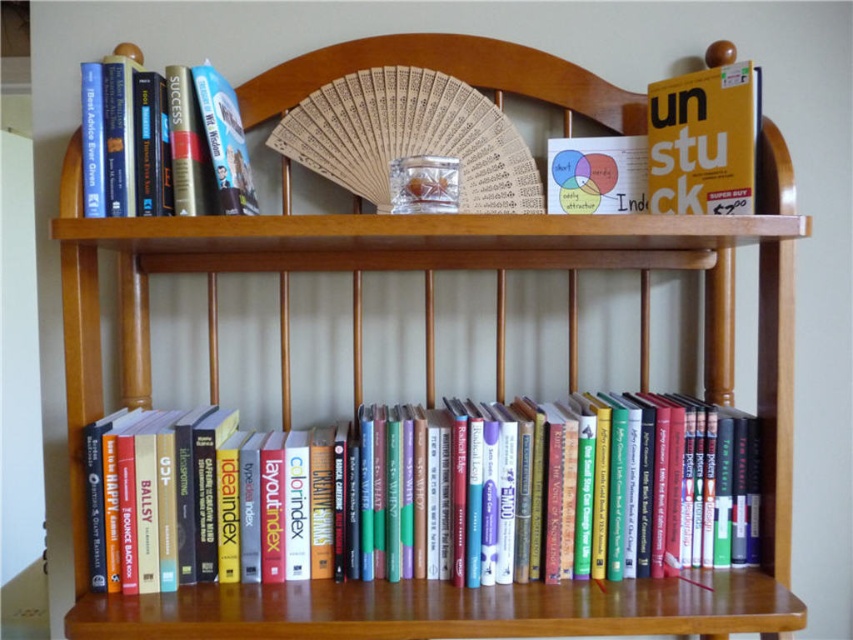
Does hardcover book at upper left come behind matte yellow book at upper right?

No, hardcover book at upper left is in front of matte yellow book at upper right.

Is hardcover book at upper left closer to the viewer compared to matte yellow book at upper right?

Yes.

Is point (90, 156) behind point (735, 72)?

No, it is in front of (735, 72).

Locate an element on the screen. The height and width of the screenshot is (640, 853). hardcover book at upper left is located at coordinates (170, 140).

Can you confirm if hardcover books at lower center is positioned to the right of hardcover book at upper left?

Correct, you'll find hardcover books at lower center to the right of hardcover book at upper left.

Does hardcover books at lower center have a lesser height compared to hardcover book at upper left?

Yes.

Who is more forward, (312, 534) or (190, 180)?

Point (190, 180) is more forward.

You are a GUI agent. You are given a task and a screenshot of the screen. Output one action in this format:
    pyautogui.click(x=<x>, y=<y>)
    Task: Click on the hardcover books at lower center
    
    Given the screenshot: What is the action you would take?
    pyautogui.click(x=425, y=496)

Who is positioned more to the right, hardcover books at lower center or matte yellow book at upper right?

matte yellow book at upper right

Does hardcover books at lower center appear on the right side of matte yellow book at upper right?

In fact, hardcover books at lower center is to the left of matte yellow book at upper right.

Where is `hardcover books at lower center`? Image resolution: width=853 pixels, height=640 pixels. hardcover books at lower center is located at coordinates (425, 496).